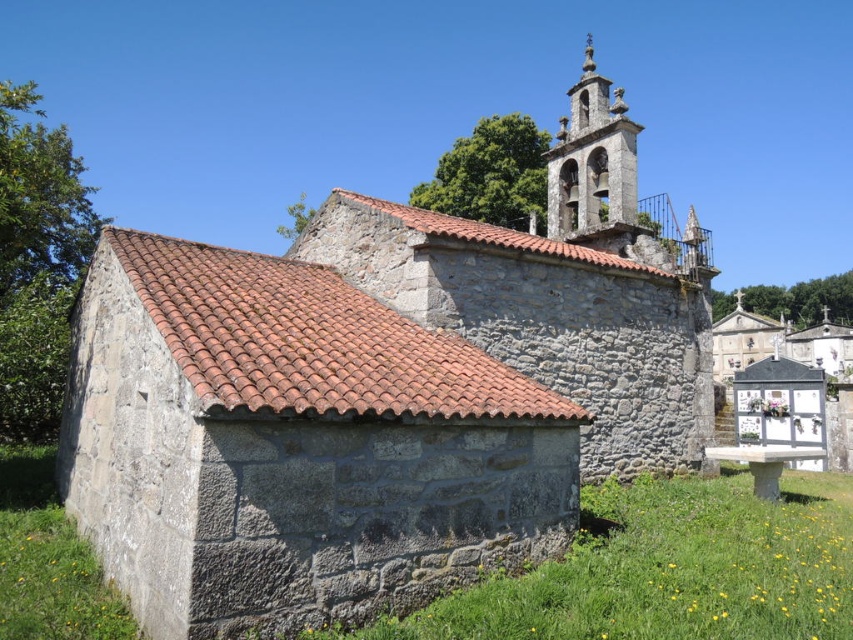
Question: Is rustic stone chapel at center below stone bell tower at upper right?

Choices:
 (A) no
 (B) yes

Answer: (B)

Question: Which point is farther to the camera?

Choices:
 (A) (573, 154)
 (B) (370, 410)

Answer: (A)

Question: Which of the following is the closest to the observer?

Choices:
 (A) rustic stone chapel at center
 (B) brown tile roof at upper left

Answer: (A)

Question: Is rustic stone chapel at center positioned behind stone bell tower at upper right?

Choices:
 (A) yes
 (B) no

Answer: (B)

Question: Can you confirm if rustic stone chapel at center is thinner than stone bell tower at upper right?

Choices:
 (A) yes
 (B) no

Answer: (B)

Question: Which point is closer to the camera taking this photo?

Choices:
 (A) (525, 509)
 (B) (572, 131)
 (C) (294, 273)

Answer: (A)